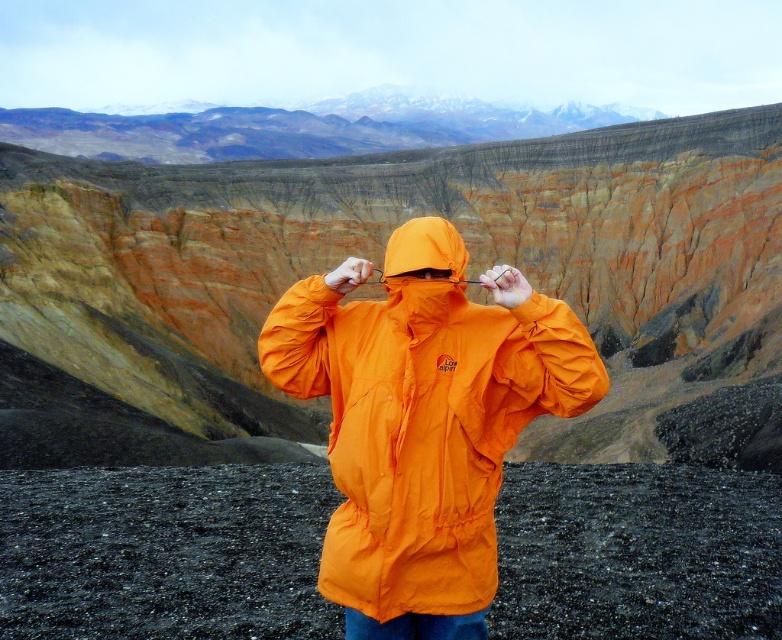
Question: Is orange fabric mountain at center to the right of orange waterproof jacket at center from the viewer's perspective?

Choices:
 (A) no
 (B) yes

Answer: (A)

Question: Which object appears farthest from the camera in this image?

Choices:
 (A) orange fabric mountain at center
 (B) orange waterproof jacket at center

Answer: (A)

Question: Considering the relative positions of orange fabric mountain at center and orange waterproof jacket at center in the image provided, where is orange fabric mountain at center located with respect to orange waterproof jacket at center?

Choices:
 (A) below
 (B) above

Answer: (B)

Question: Which point is farther from the camera taking this photo?

Choices:
 (A) (572, 308)
 (B) (397, 520)

Answer: (A)

Question: Is orange fabric mountain at center thinner than orange waterproof jacket at center?

Choices:
 (A) no
 (B) yes

Answer: (A)